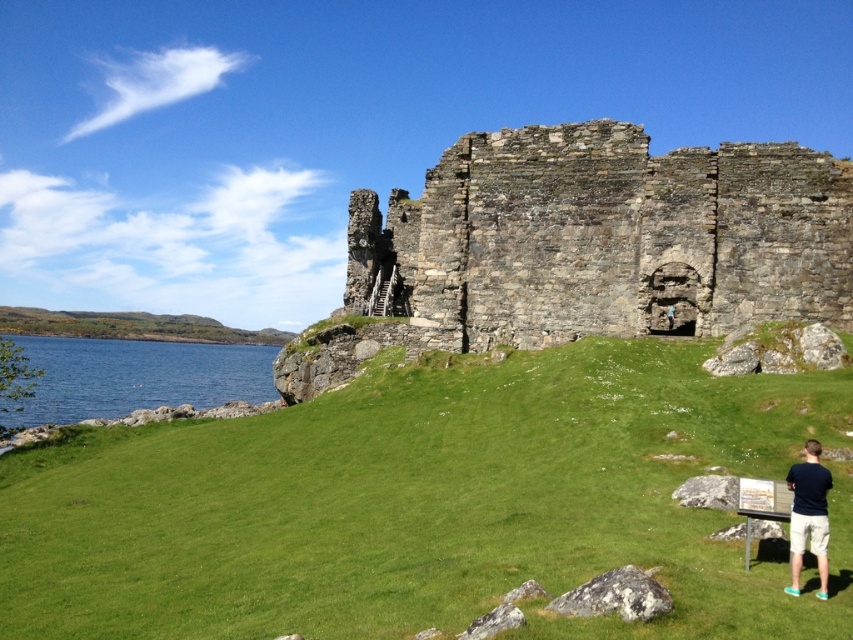
You are standing at the base of the rustic stone castle at center and want to walk to the viewpoint located 200 feet away. Can you reach the viewpoint without leaving the immediate area around the castle?

The rustic stone castle at center and viewer are 197.86 feet apart from each other, so yes, you can reach the viewpoint as the distance is slightly less than 200 feet.

Consider the image. You are a photographer positioned at the rustic stone castle at center and want to capture the dark blue shirt at lower right in your shot. Since you can only focus on one subject at a time, which subject should you focus on first to ensure it appears sharp in the photo?

You should focus on the rustic stone castle at center first because it is closer to you than the dark blue shirt at lower right, ensuring it will be sharp while the background subject may appear slightly blurred.

Consider the image. You are standing at the base of the green grassy hill at left and want to walk to the green grassy at center. Which direction should you move relative to the hill?

You should move downward towards the green grassy at center since it is positioned under the green grassy hill at left, indicating it is lower in elevation.